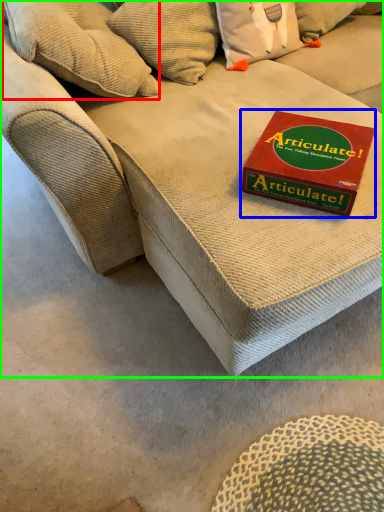
Question: Which object is positioned closest to pillow (highlighted by a red box)? Select from paperback book (highlighted by a blue box) and studio couch (highlighted by a green box).

Choices:
 (A) paperback book
 (B) studio couch

Answer: (B)